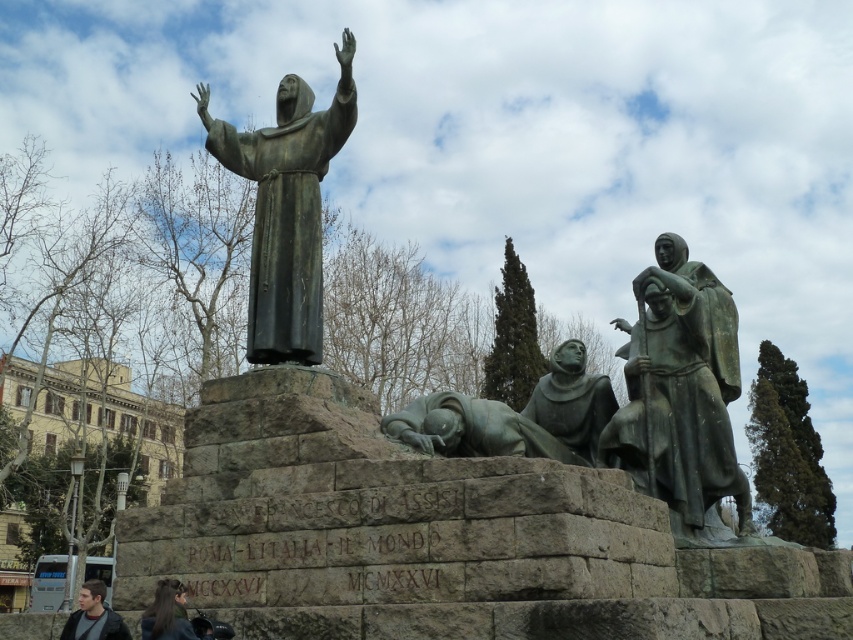
Between point (90, 604) and point (170, 611), which one is positioned behind?

Positioned behind is point (90, 604).

From the picture: Who is more forward, (117, 618) or (158, 589)?

Positioned in front is point (117, 618).

Describe the element at coordinates (94, 616) in the screenshot. I see `dark gray jacket at lower left` at that location.

You are a GUI agent. You are given a task and a screenshot of the screen. Output one action in this format:
    pyautogui.click(x=<x>, y=<y>)
    Task: Click on the dark gray jacket at lower left
    This screenshot has width=853, height=640.
    Given the screenshot: What is the action you would take?
    pyautogui.click(x=94, y=616)

Who is positioned more to the left, bronze statue at right or bronze statue of monks at center?

From the viewer's perspective, bronze statue of monks at center appears more on the left side.

At what (x,y) coordinates should I click in order to perform the action: click on bronze statue at right. Please return your answer as a coordinate pair (x, y). The width and height of the screenshot is (853, 640). Looking at the image, I should click on (680, 392).

Identify the location of bronze statue at right. The image size is (853, 640). (680, 392).

This screenshot has width=853, height=640. What do you see at coordinates (572, 401) in the screenshot?
I see `bronze statue of monks at center` at bounding box center [572, 401].

Can you confirm if bronze statue of monks at center is bigger than dark gray jacket at lower left?

No, bronze statue of monks at center is not bigger than dark gray jacket at lower left.

Where is `bronze statue of monks at center`? This screenshot has height=640, width=853. bronze statue of monks at center is located at coordinates (572, 401).

Locate an element on the screen. This screenshot has height=640, width=853. bronze statue of monks at center is located at coordinates (572, 401).